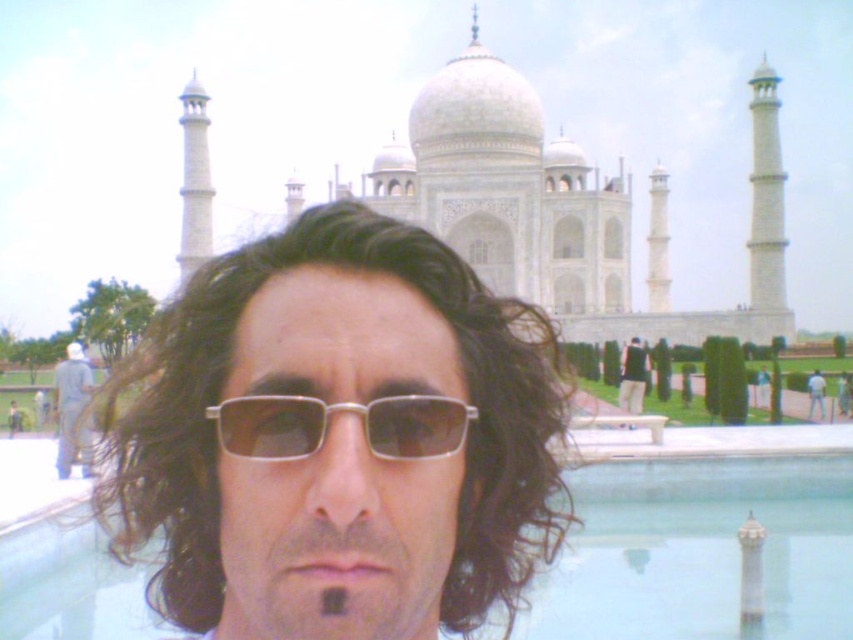
Question: Which point is closer to the camera taking this photo?

Choices:
 (A) tap(49, 476)
 (B) tap(647, 376)

Answer: (A)

Question: In this image, where is clear glass pool at center located relative to black fabric shirt at center?

Choices:
 (A) below
 (B) above

Answer: (A)

Question: In this image, where is black fabric shirt at center located relative to white matte baseball uniform at center?

Choices:
 (A) left
 (B) right

Answer: (A)

Question: Which point is closer to the camera?

Choices:
 (A) (57, 625)
 (B) (206, 412)
 (C) (817, 394)

Answer: (B)

Question: Which point is farther from the camera taking this photo?

Choices:
 (A) click(x=809, y=381)
 (B) click(x=206, y=480)
 (C) click(x=74, y=451)
 (D) click(x=308, y=429)

Answer: (A)

Question: Is dark curly hair at center above black fabric shirt at center?

Choices:
 (A) no
 (B) yes

Answer: (A)